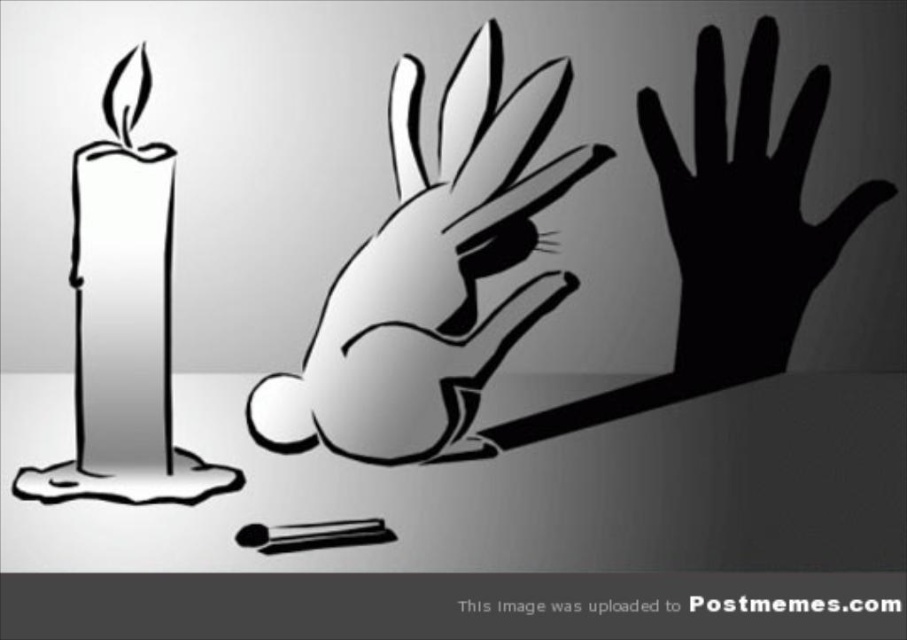
Question: Which point appears farthest from the camera in this image?

Choices:
 (A) (503, 131)
 (B) (88, 204)

Answer: (A)

Question: Does black shadow hand at right have a lesser width compared to white matte candle at left?

Choices:
 (A) yes
 (B) no

Answer: (B)

Question: Can you confirm if black shadow hand at right is positioned above white matte candle at left?

Choices:
 (A) yes
 (B) no

Answer: (A)

Question: Estimate the real-world distances between objects in this image. Which object is closer to the shiny silver bunny at center?

Choices:
 (A) black shadow hand at right
 (B) white matte candle at left

Answer: (B)

Question: Which of these objects is positioned closest to the white matte candle at left?

Choices:
 (A) black shadow hand at right
 (B) shiny silver bunny at center

Answer: (B)

Question: Where is shiny silver bunny at center located in relation to black shadow hand at right in the image?

Choices:
 (A) below
 (B) above

Answer: (A)